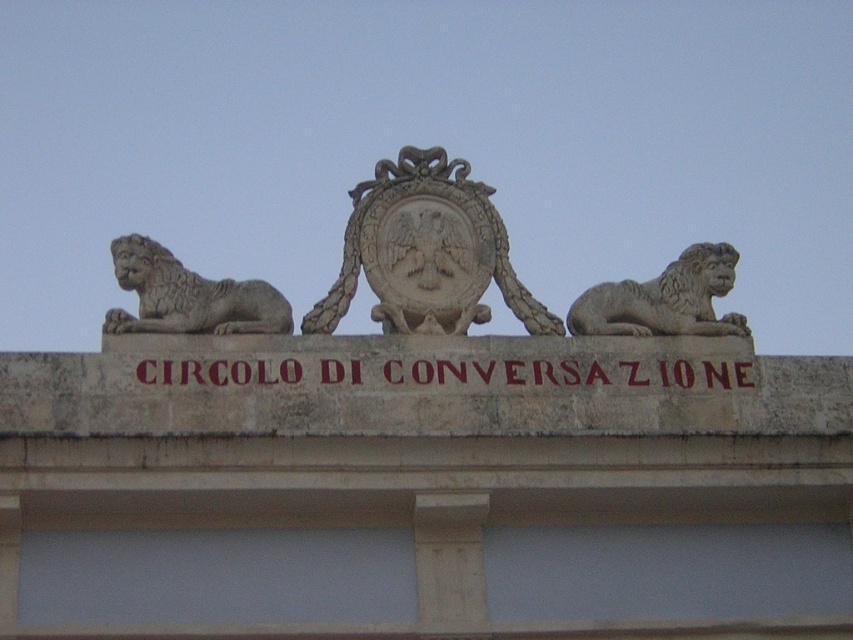
Question: Considering the relative positions of gray stone lion at left and gray stone lion at upper right in the image provided, where is gray stone lion at left located with respect to gray stone lion at upper right?

Choices:
 (A) below
 (B) above

Answer: (B)

Question: Among these points, which one is farthest from the camera?

Choices:
 (A) (120, 280)
 (B) (463, 228)

Answer: (B)

Question: Does brown stone sign at center appear under gray stone lion at upper right?

Choices:
 (A) no
 (B) yes

Answer: (B)

Question: Which is farther from the brown stone sign at center?

Choices:
 (A) gray stone lion at upper right
 (B) gray stone lion at left

Answer: (B)

Question: Which object appears farthest from the camera in this image?

Choices:
 (A) gray stone lion at left
 (B) gray stone lion at upper right
 (C) stone coat of arms at center
 (D) brown stone sign at center

Answer: (B)

Question: Is stone coat of arms at center above gray stone lion at left?

Choices:
 (A) no
 (B) yes

Answer: (B)